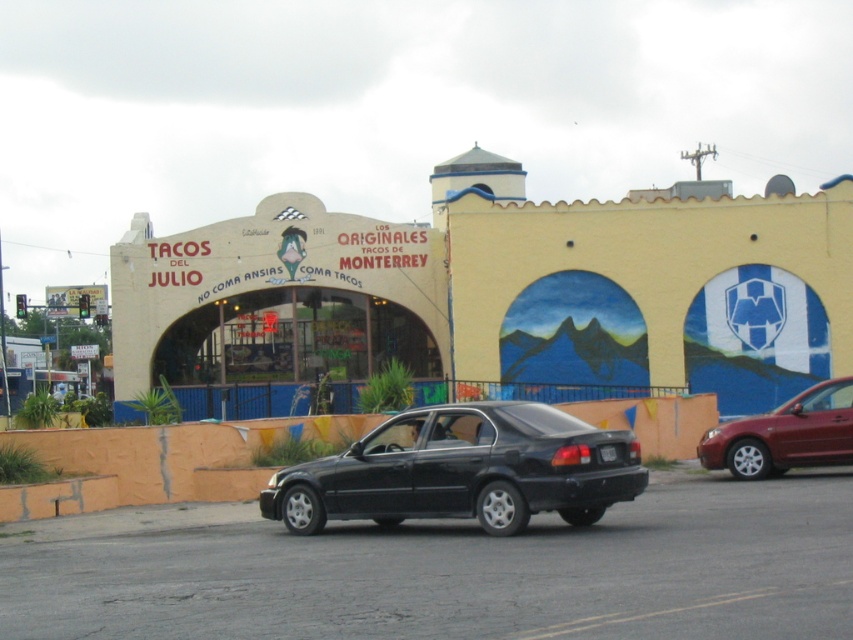
Where is `maroon metallic sedan at right`? The width and height of the screenshot is (853, 640). maroon metallic sedan at right is located at coordinates (785, 435).

Does point (743, 477) come farther from viewer compared to point (601, 448)?

That is True.

Does point (846, 440) lie in front of point (608, 451)?

That is False.

Find the location of a particular element. The width and height of the screenshot is (853, 640). maroon metallic sedan at right is located at coordinates (785, 435).

Can you confirm if matte black sedan at center is positioned below maroon metallic sedan at right?

No.

Can you confirm if matte black sedan at center is wider than maroon metallic sedan at right?

Yes, matte black sedan at center is wider than maroon metallic sedan at right.

Who is more distant from viewer, (294, 496) or (814, 456)?

The point (814, 456) is behind.

This screenshot has height=640, width=853. Identify the location of matte black sedan at center. (462, 470).

Between matte black sedan at center and black plastic license plate at rear, which one is positioned higher?

black plastic license plate at rear

Does matte black sedan at center appear on the right side of black plastic license plate at rear?

No, matte black sedan at center is not to the right of black plastic license plate at rear.

Does point (566, 416) lie in front of point (599, 449)?

That is False.

Identify the location of matte black sedan at center. The image size is (853, 640). (462, 470).